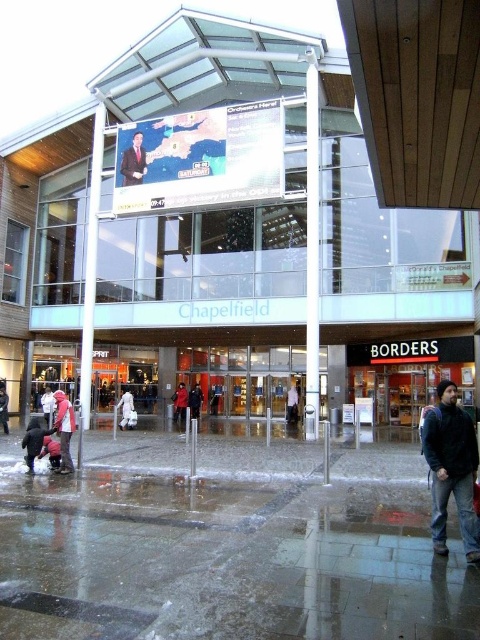
You are standing outside Chapelfield shopping center on a rainy day. You see a glass pane at center and a white cotton shirt at center. Which object is bigger in size?

The glass pane at center is larger in size compared to the white cotton shirt at center.

You are standing at the entrance of Chapelfield shopping center on a rainy day. You notice a point marked at coordinates [312,250]. What object is located at this point?

The point at coordinates [312,250] marks the location of the glass pane at center.

In the scene shown: You are standing at the entrance of Chapelfield shopping center on a rainy day. You see a glass pane at center and a white cotton shirt at center. Which object is higher from the ground?

The glass pane at center is located above the white cotton shirt at center, so it is higher from the ground.